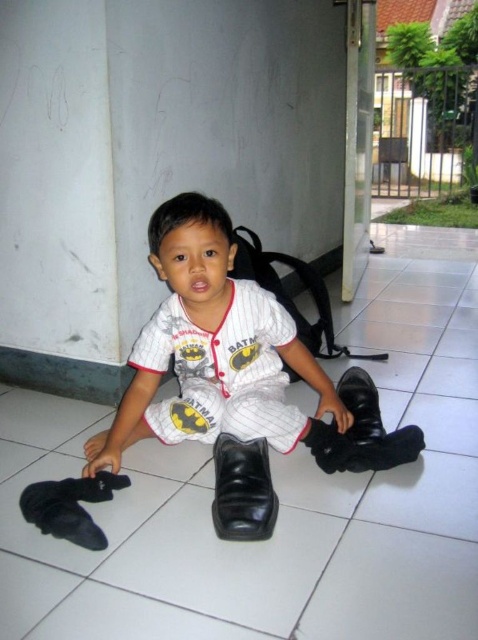
You are a parent trying to decide which pair of shoes to put on your child. The child is sitting on the floor with two pairs of shoes. The matte black shoes at center and the black leather boot at lower center. Which pair is physically closer to the child?

The matte black shoes at center is closer to the viewer than the black leather boot at lower center, so the matte black shoes at center is physically closer to the child.

The child is holding the matte black shoes at center and wearing the white fabric baseball uniform at center. Which item has a greater width?

The matte black shoes at center has a greater width than the white fabric baseball uniform at center.